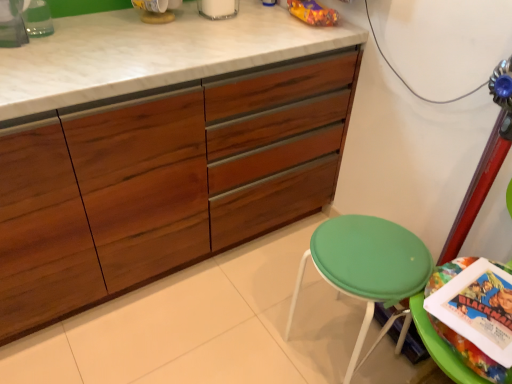
The image size is (512, 384). What are the coordinates of `vacant point above green fabric stool at lower right (from a real-world perspective)` in the screenshot? It's located at (376, 251).